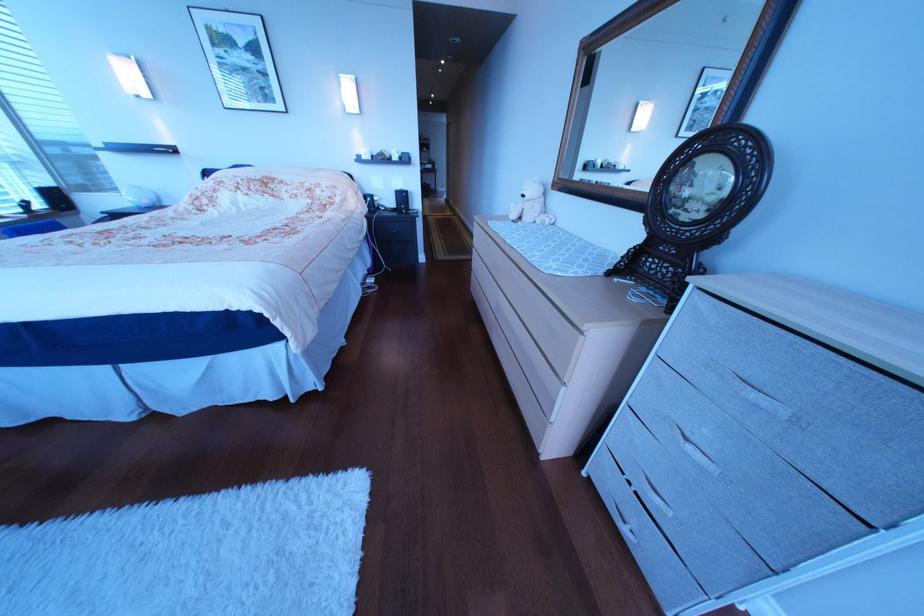
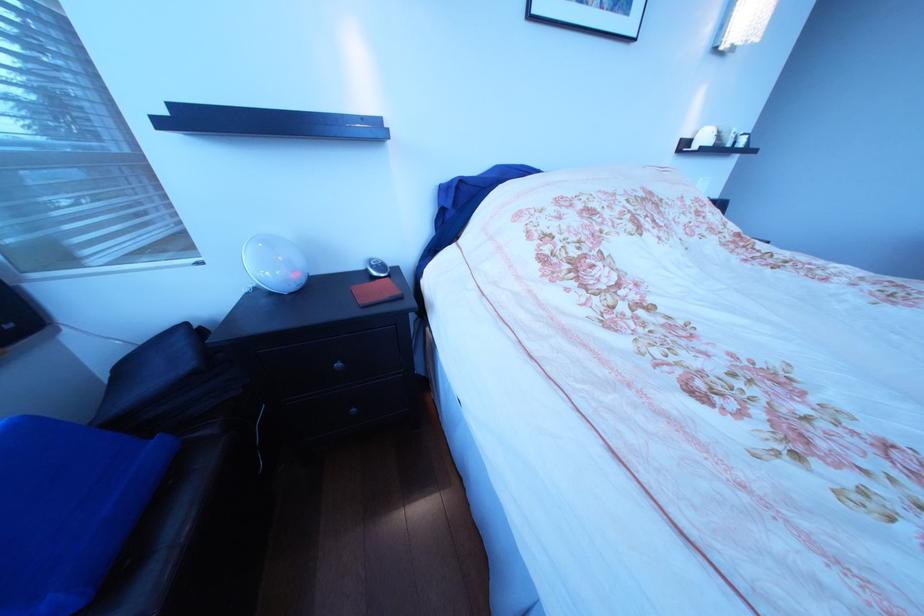
Find the pixel in the second image that matches pixel 384 160 in the first image.

(724, 146)